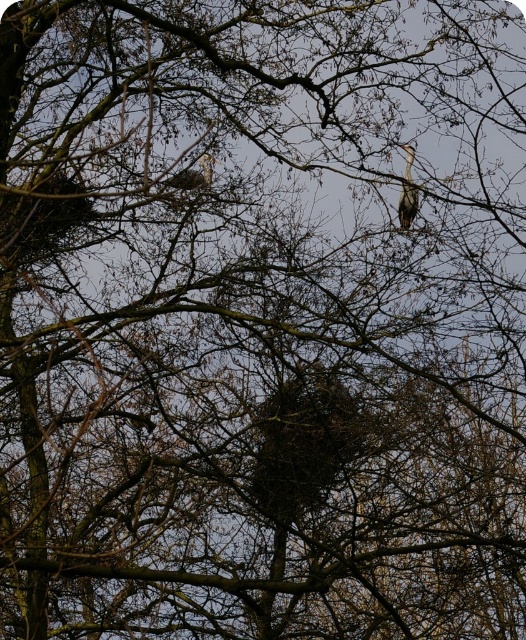
You are a birdwatcher observing the two birds perched on the branches in the image. The birds are located at coordinates point (399,214) and point (204,156). Which bird is closer to you?

Point (399,214) is closer to the viewer than point (204,156), so the bird at point (399,214) is closer to you.

You are a birdwatcher observing the gray feathered bird at upper right and the white feathered bird at upper center in the tree branches. Which bird has a smaller size?

The gray feathered bird at upper right is smaller than the white feathered bird at upper center.